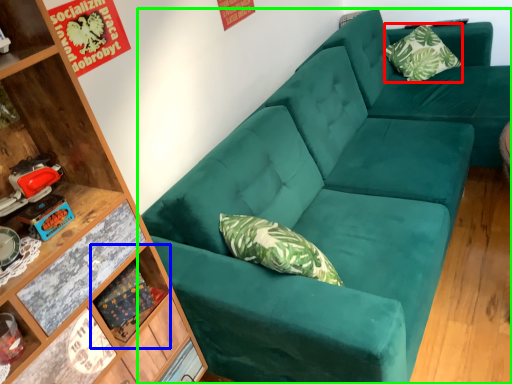
Question: Estimate the real-world distances between objects in this image. Which object is closer to pillow (highlighted by a red box), shelf (highlighted by a blue box) or studio couch (highlighted by a green box)?

Choices:
 (A) shelf
 (B) studio couch

Answer: (B)